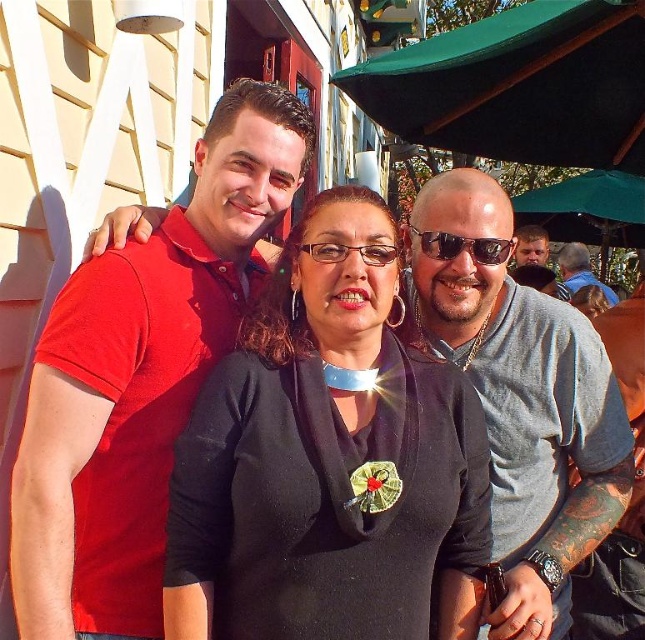
Does gray fabric shirt at right have a greater height compared to black leather jacket at center?

Correct, gray fabric shirt at right is much taller as black leather jacket at center.

Does gray fabric shirt at right have a larger size compared to black leather jacket at center?

Yes.

Where is `gray fabric shirt at right`? The height and width of the screenshot is (640, 645). gray fabric shirt at right is located at coordinates (535, 262).

Between matte red polo shirt at left and black leather jacket at center, which one is positioned lower?

matte red polo shirt at left

Which is more to the right, matte red polo shirt at left or black leather jacket at center?

black leather jacket at center

Between point (190, 268) and point (582, 301), which one is positioned behind?

Point (582, 301)

This screenshot has height=640, width=645. I want to click on matte red polo shirt at left, so click(141, 378).

Is matte red polo shirt at left below sunglasses at center?

Correct, matte red polo shirt at left is located below sunglasses at center.

Find the location of `matte red polo shirt at left`. matte red polo shirt at left is located at coordinates (141, 378).

Describe the element at coordinates (141, 378) in the screenshot. I see `matte red polo shirt at left` at that location.

The width and height of the screenshot is (645, 640). I want to click on matte red polo shirt at left, so click(x=141, y=378).